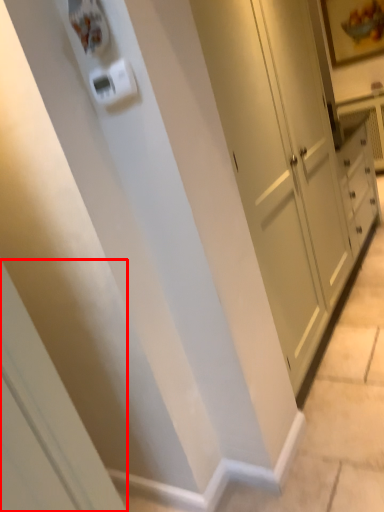
Question: Observing the image, what is the correct spatial positioning of screen door (annotated by the red box) in reference to light switch?

Choices:
 (A) left
 (B) right

Answer: (A)